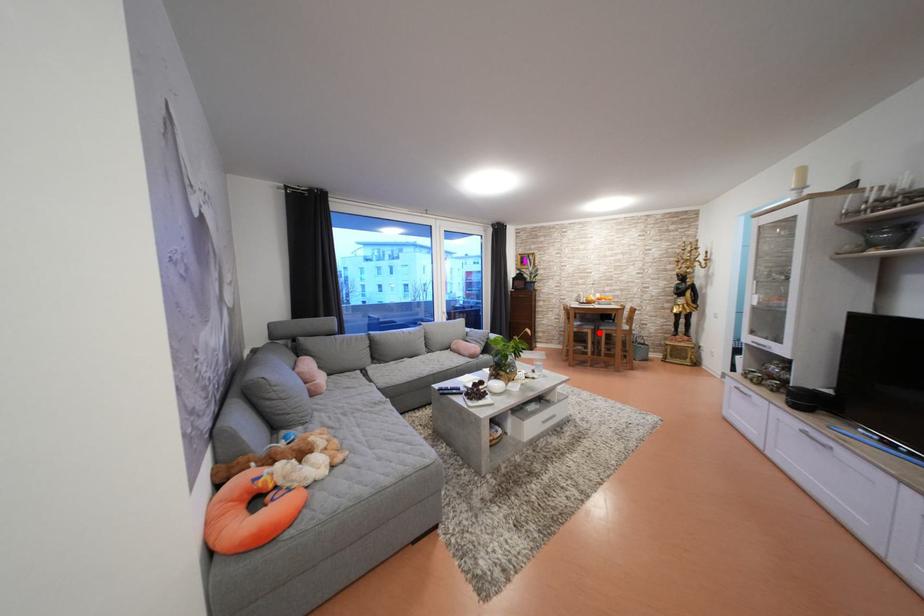
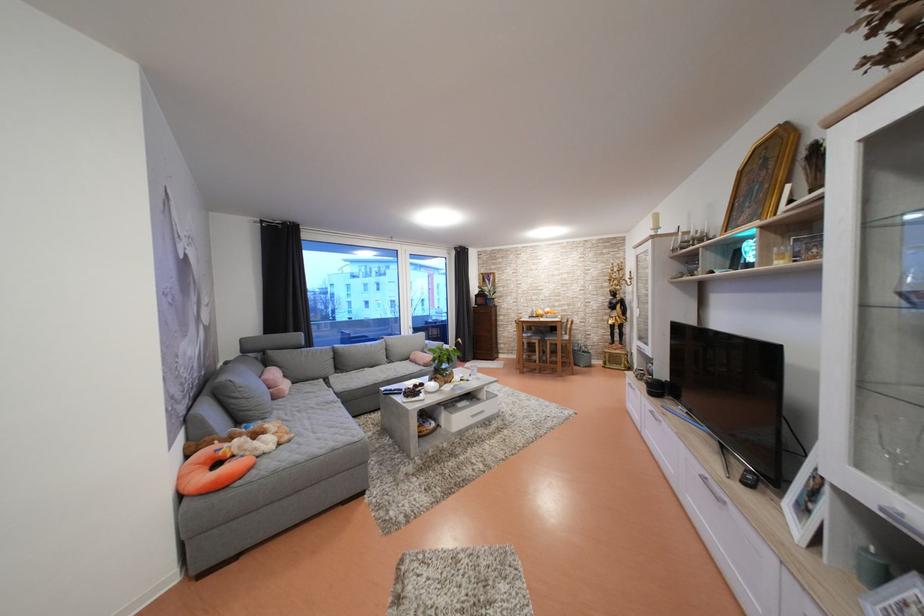
Where in the second image is the point corresponding to the highlighted location from the first image?

(545, 342)